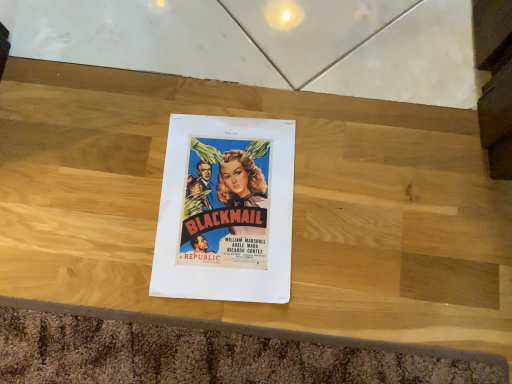
Question: Should I look upward or downward to see matte paper poster at center?

Choices:
 (A) down
 (B) up

Answer: (A)